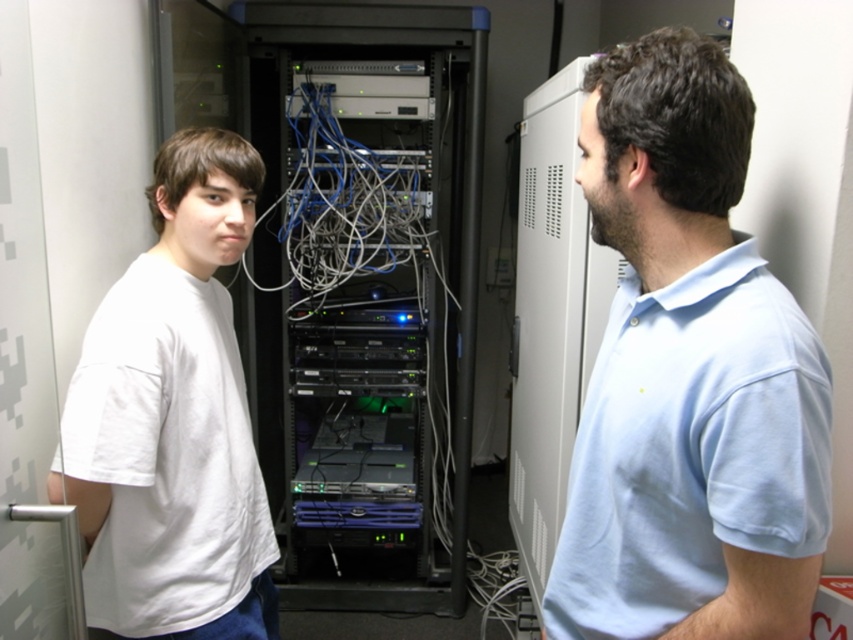
Question: Which point is closer to the camera?

Choices:
 (A) (221, 609)
 (B) (619, 557)

Answer: (B)

Question: Is light blue cotton shirt at center positioned at the back of white cotton t-shirt at left?

Choices:
 (A) no
 (B) yes

Answer: (A)

Question: Considering the relative positions of light blue cotton shirt at center and white cotton t-shirt at left in the image provided, where is light blue cotton shirt at center located with respect to white cotton t-shirt at left?

Choices:
 (A) left
 (B) right

Answer: (B)

Question: Observing the image, what is the correct spatial positioning of light blue cotton shirt at center in reference to white cotton t-shirt at left?

Choices:
 (A) above
 (B) below

Answer: (A)